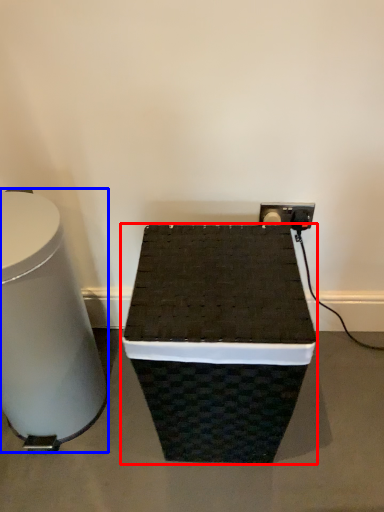
Question: Among these objects, which one is nearest to the camera, furniture (highlighted by a red box) or table (highlighted by a blue box)?

Choices:
 (A) furniture
 (B) table

Answer: (B)